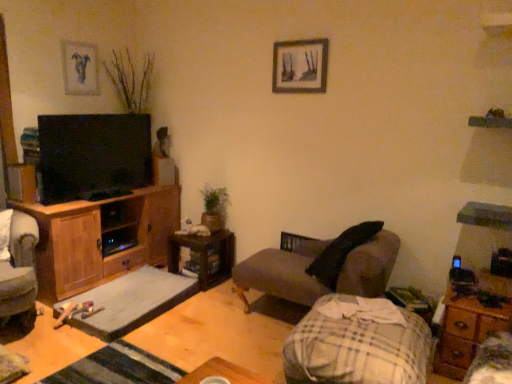
Where is `vacant area on top of wooden nightstand at lower right (from a real-world perspective)`? This screenshot has height=384, width=512. vacant area on top of wooden nightstand at lower right (from a real-world perspective) is located at coordinates [x=485, y=294].